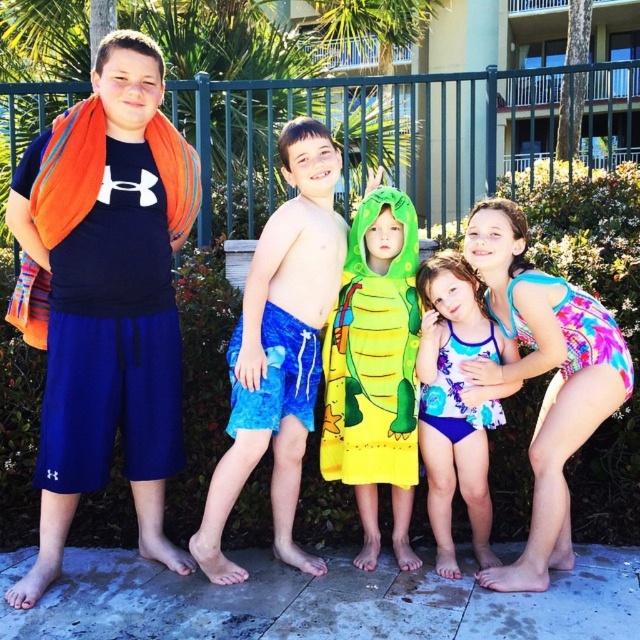
You are standing at the center of the image looking at the five children. Which child is wearing the orange towel at left?

The first child from the left is wearing the orange towel at left, as it is located at point (109, 300) which corresponds to the leftmost position in the image.

You are a photographer trying to capture the children in the image. You need to know the position of the blue printed swimsuit at center and the printed fabric swimsuit at center relative to each other. Which one is on the right side?

The blue printed swimsuit at center is to the right of the printed fabric swimsuit at center.

Looking at this image, you are a photographer trying to capture a photo of the children. You want to ensure that the yellow fabric towel at center and the printed fabric swimsuit at center are both visible in the frame. Based on their positions, which one should you focus on first to include both in the shot?

The yellow fabric towel at center is to the left of the printed fabric swimsuit at center, so focusing on the printed fabric swimsuit at center first would allow you to include both in the frame since it is positioned to the right of the yellow fabric towel at center.